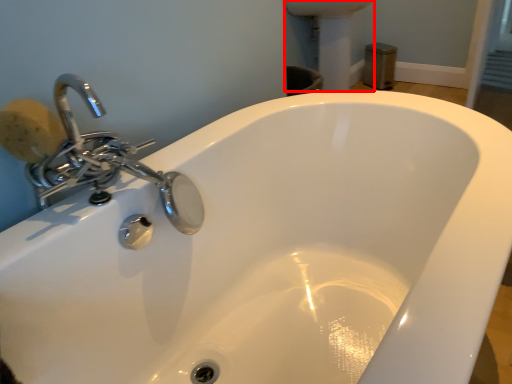
Question: Where is porcelain (annotated by the red box) located in relation to soap in the image?

Choices:
 (A) left
 (B) right

Answer: (B)